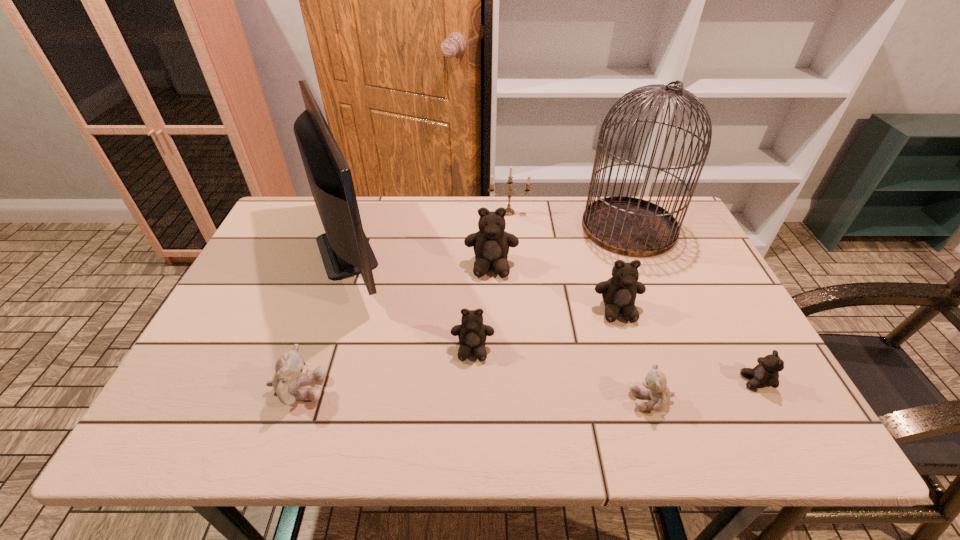
Identify the location of vacant point located 0.340m on the face of the left gray teddy bear. (485, 389).

Where is `vacant area situated on the face of the rightmost teddy bear`? The width and height of the screenshot is (960, 540). vacant area situated on the face of the rightmost teddy bear is located at coordinates (571, 381).

You are a GUI agent. You are given a task and a screenshot of the screen. Output one action in this format:
    pyautogui.click(x=<x>, y=<y>)
    Task: Click on the vacant area situated on the face of the rightmost teddy bear
    
    Given the screenshot: What is the action you would take?
    pyautogui.click(x=571, y=381)

Locate an element on the screen. This screenshot has width=960, height=540. vacant region located 0.340m on the face of the rightmost teddy bear is located at coordinates (586, 381).

Locate an element on the screen. free location located 0.380m on the face of the smaller gray teddy bear is located at coordinates (448, 400).

Locate an element on the screen. free spot located on the face of the smaller gray teddy bear is located at coordinates click(448, 400).

What are the coordinates of `free space located on the face of the smaller gray teddy bear` in the screenshot? It's located at (549, 400).

Locate an element on the screen. birdcage located at the far edge is located at coordinates (629, 226).

Locate an element on the screen. computer monitor that is at the far edge is located at coordinates (345, 250).

You are a GUI agent. You are given a task and a screenshot of the screen. Output one action in this format:
    pyautogui.click(x=<x>, y=<y>)
    Task: Click on the candle that is at the far edge
    Image resolution: width=960 pixels, height=540 pixels.
    Given the screenshot: What is the action you would take?
    pyautogui.click(x=510, y=211)